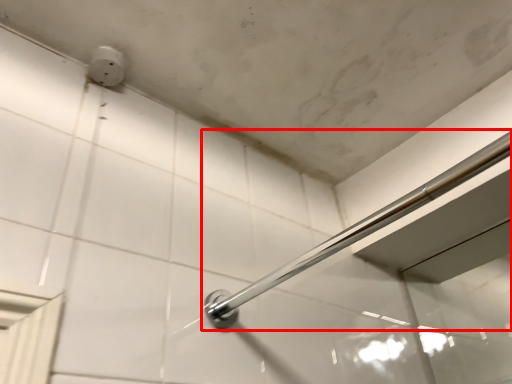
Question: In this image, where is door handle (annotated by the red box) located relative to electric outlet?

Choices:
 (A) left
 (B) right

Answer: (B)